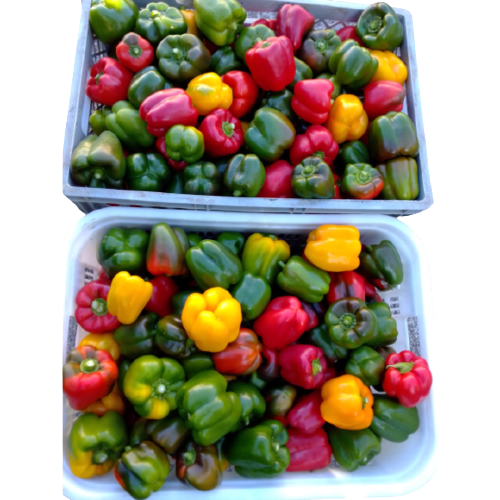
Identify the location of baskets. (408, 254), (415, 204).